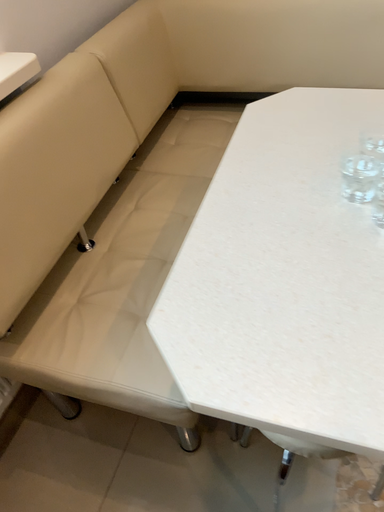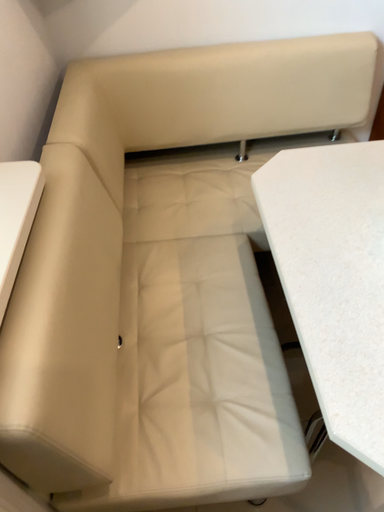
Question: How did the camera likely rotate when shooting the video?

Choices:
 (A) rotated right
 (B) rotated left

Answer: (A)